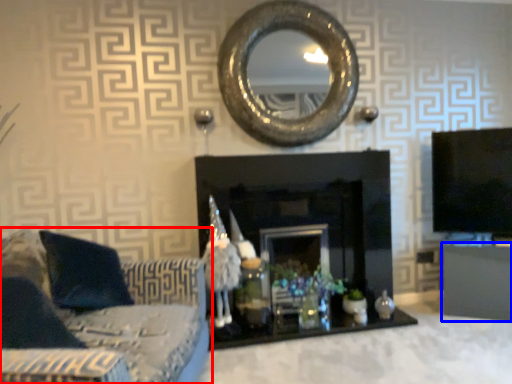
Question: Which point is closer to the camera, studio couch (highlighted by a red box) or furniture (highlighted by a blue box)?

Choices:
 (A) studio couch
 (B) furniture

Answer: (A)